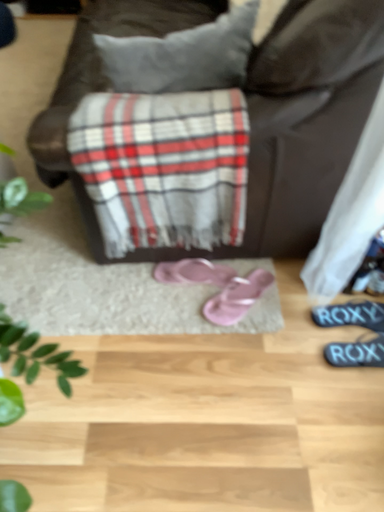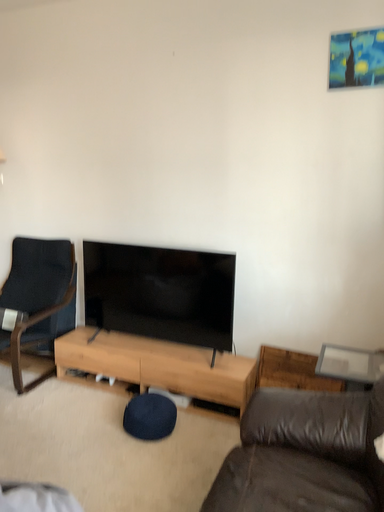
Question: How did the camera likely rotate when shooting the video?

Choices:
 (A) rotated upward
 (B) rotated downward

Answer: (A)